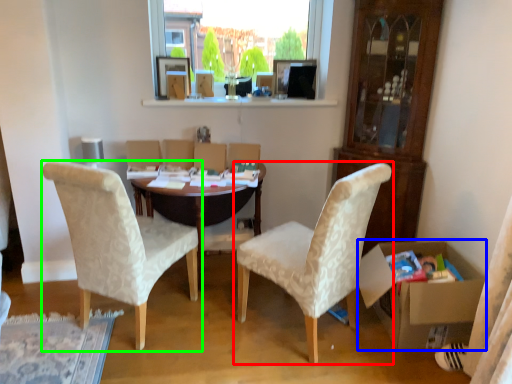
Question: Considering the real-world distances, which object is farthest from chair (highlighted by a red box)? box (highlighted by a blue box) or chair (highlighted by a green box)?

Choices:
 (A) box
 (B) chair

Answer: (B)